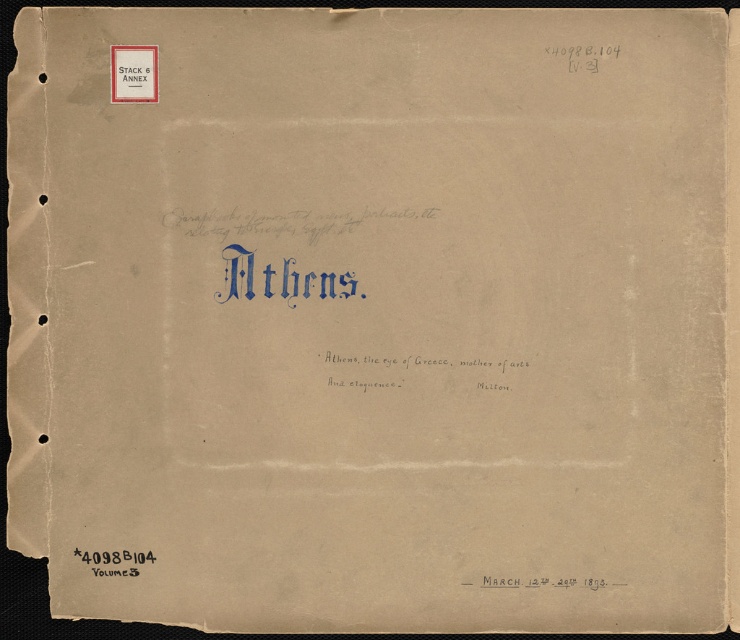
Question: Does black ink writing at center appear on the left side of matte white sign at upper left?

Choices:
 (A) no
 (B) yes

Answer: (A)

Question: Which point appears closest to the camera in this image?

Choices:
 (A) (497, 358)
 (B) (115, 92)

Answer: (B)

Question: Which point is closer to the camera?

Choices:
 (A) black ink writing at center
 (B) matte white sign at upper left

Answer: (B)

Question: Which point appears farthest from the camera in this image?

Choices:
 (A) (131, 88)
 (B) (360, 388)

Answer: (B)

Question: Is black ink writing at center behind matte white sign at upper left?

Choices:
 (A) yes
 (B) no

Answer: (A)

Question: Is black ink writing at center to the right of matte white sign at upper left from the viewer's perspective?

Choices:
 (A) no
 (B) yes

Answer: (B)